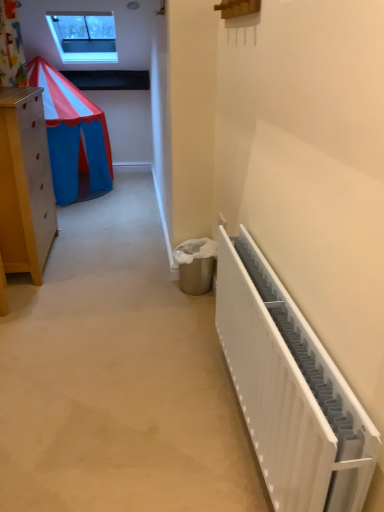
Question: Visually, is white matte radiator at right positioned to the left or to the right of transparent glass window at upper center?

Choices:
 (A) left
 (B) right

Answer: (B)

Question: Considering the positions of white matte radiator at right and transparent glass window at upper center in the image, is white matte radiator at right wider or thinner than transparent glass window at upper center?

Choices:
 (A) thin
 (B) wide

Answer: (A)

Question: Based on their sizes in the image, would you say white matte radiator at right is bigger or smaller than transparent glass window at upper center?

Choices:
 (A) big
 (B) small

Answer: (B)

Question: Based on their sizes in the image, would you say transparent glass window at upper center is bigger or smaller than white matte radiator at right?

Choices:
 (A) small
 (B) big

Answer: (B)

Question: Is transparent glass window at upper center to the left or to the right of white matte radiator at right in the image?

Choices:
 (A) right
 (B) left

Answer: (B)

Question: From a real-world perspective, relative to white matte radiator at right, is transparent glass window at upper center vertically above or below?

Choices:
 (A) above
 (B) below

Answer: (A)

Question: Is transparent glass window at upper center spatially inside white matte radiator at right, or outside of it?

Choices:
 (A) outside
 (B) inside

Answer: (A)